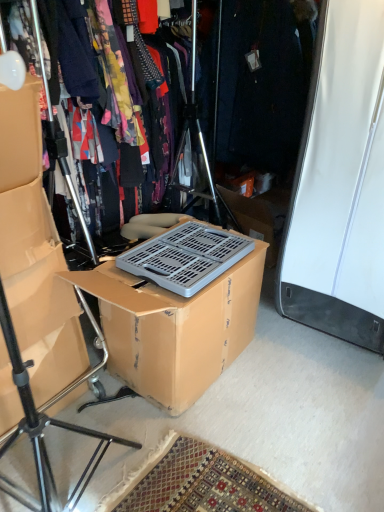
Question: From the image's perspective, would you say brown cardboard box at center is shown under floral fabric dress at center?

Choices:
 (A) yes
 (B) no

Answer: (A)

Question: From the image's perspective, is brown cardboard box at center located above floral fabric dress at center?

Choices:
 (A) yes
 (B) no

Answer: (B)

Question: From a real-world perspective, is brown cardboard box at center physically below floral fabric dress at center?

Choices:
 (A) no
 (B) yes

Answer: (B)

Question: Considering the relative sizes of brown cardboard box at center and floral fabric dress at center in the image provided, is brown cardboard box at center taller than floral fabric dress at center?

Choices:
 (A) no
 (B) yes

Answer: (A)

Question: Is brown cardboard box at center at the left side of floral fabric dress at center?

Choices:
 (A) no
 (B) yes

Answer: (A)

Question: Choose the correct answer: Is floral fabric dress at center inside matte cardboard box at left or outside it?

Choices:
 (A) inside
 (B) outside

Answer: (B)

Question: Is point (79, 34) closer or farther from the camera than point (9, 279)?

Choices:
 (A) farther
 (B) closer

Answer: (A)

Question: From their relative heights in the image, would you say floral fabric dress at center is taller or shorter than matte cardboard box at left?

Choices:
 (A) short
 (B) tall

Answer: (A)

Question: Is floral fabric dress at center in front of or behind matte cardboard box at left in the image?

Choices:
 (A) behind
 (B) front

Answer: (A)

Question: Is brown cardboard box at center taller or shorter than matte cardboard box at left?

Choices:
 (A) short
 (B) tall

Answer: (A)

Question: Is point (140, 274) positioned closer to the camera than point (31, 231)?

Choices:
 (A) closer
 (B) farther

Answer: (B)

Question: Based on their positions, is brown cardboard box at center located to the left or right of matte cardboard box at left?

Choices:
 (A) right
 (B) left

Answer: (A)

Question: In the image, is brown cardboard box at center positioned in front of or behind matte cardboard box at left?

Choices:
 (A) behind
 (B) front

Answer: (A)

Question: Considering the positions of matte black tripod at left and floral fabric dress at center in the image, is matte black tripod at left bigger or smaller than floral fabric dress at center?

Choices:
 (A) small
 (B) big

Answer: (B)

Question: Based on their positions, is matte black tripod at left located to the left or right of floral fabric dress at center?

Choices:
 (A) left
 (B) right

Answer: (A)